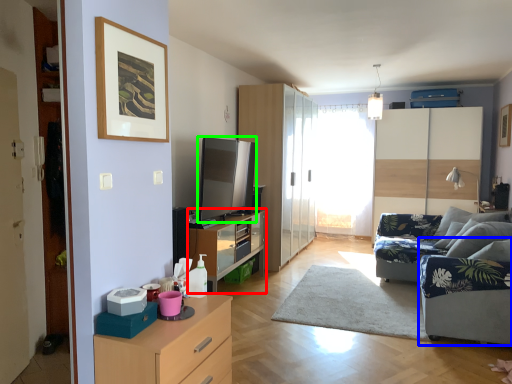
Question: Based on their relative distances, which object is farther from dresser (highlighted by a red box)? Choose from armchair (highlighted by a blue box) and appliance (highlighted by a green box).

Choices:
 (A) armchair
 (B) appliance

Answer: (A)